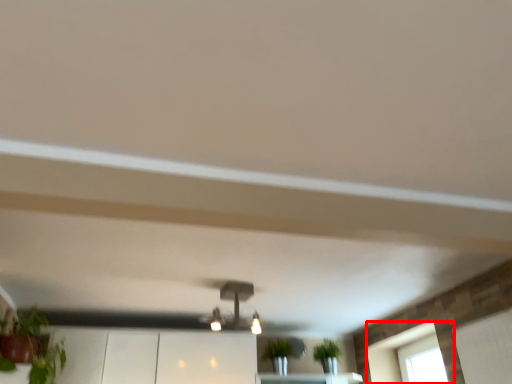
Question: From the image's perspective, where is window (annotated by the red box) located relative to light fixture?

Choices:
 (A) below
 (B) above

Answer: (A)